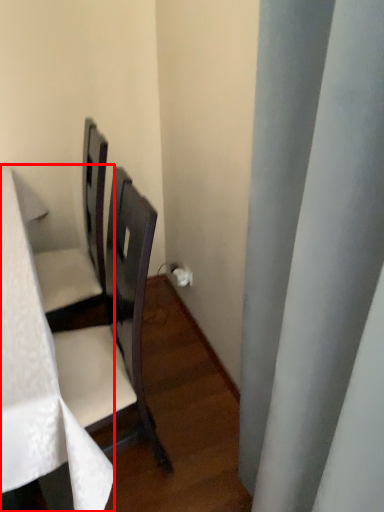
Question: From the image's perspective, where is table (annotated by the red box) located relative to curtain?

Choices:
 (A) above
 (B) below

Answer: (B)